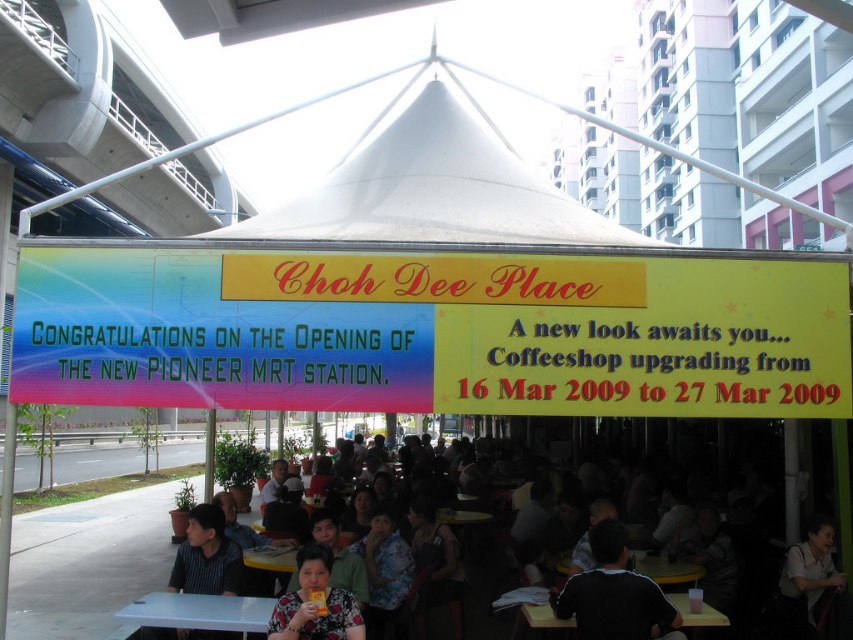
Question: Among these points, which one is farthest from the camera?

Choices:
 (A) [x=799, y=627]
 (B) [x=515, y=636]
 (C) [x=570, y=588]
 (D) [x=370, y=256]

Answer: (B)

Question: Is floral shirt at lower center above yellow plastic table at lower center?

Choices:
 (A) no
 (B) yes

Answer: (A)

Question: Which object is closer to the camera taking this photo?

Choices:
 (A) white glossy table at lower left
 (B) floral fabric shirt at lower center
 (C) floral fabric shirt at center
 (D) yellow plastic table at lower center

Answer: (B)

Question: Can you confirm if floral shirt at lower center is smaller than black shirt at lower center?

Choices:
 (A) yes
 (B) no

Answer: (B)

Question: Is multicolored plastic signboard at center behind black shirt at lower center?

Choices:
 (A) no
 (B) yes

Answer: (B)

Question: Which is nearer to the floral shirt at lower center?

Choices:
 (A) yellow plastic table at lower center
 (B) white glossy table at lower left
 (C) floral fabric shirt at lower center

Answer: (A)